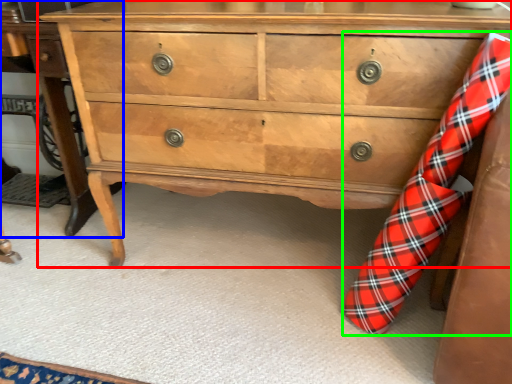
Question: Which object is the closest to the chest of drawers (highlighted by a red box)? Choose among these: table (highlighted by a blue box) or sock (highlighted by a green box).

Choices:
 (A) table
 (B) sock

Answer: (B)